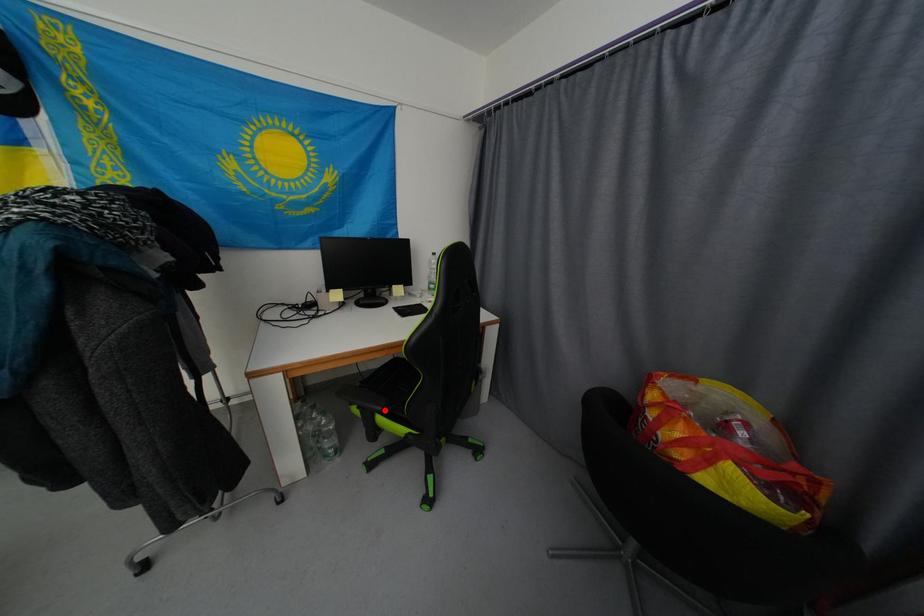
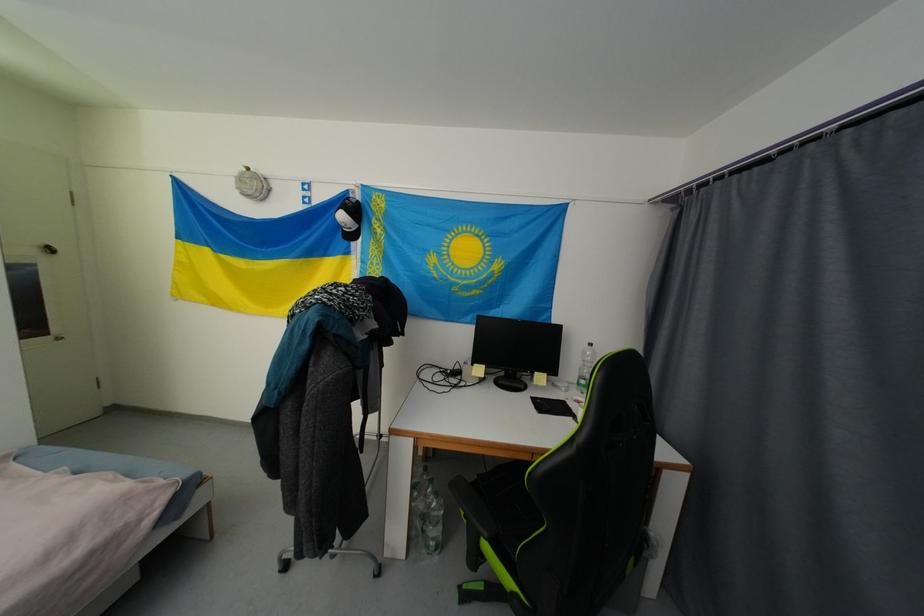
The point at the highlighted location is marked in the first image. Where is the corresponding point in the second image?

(492, 536)